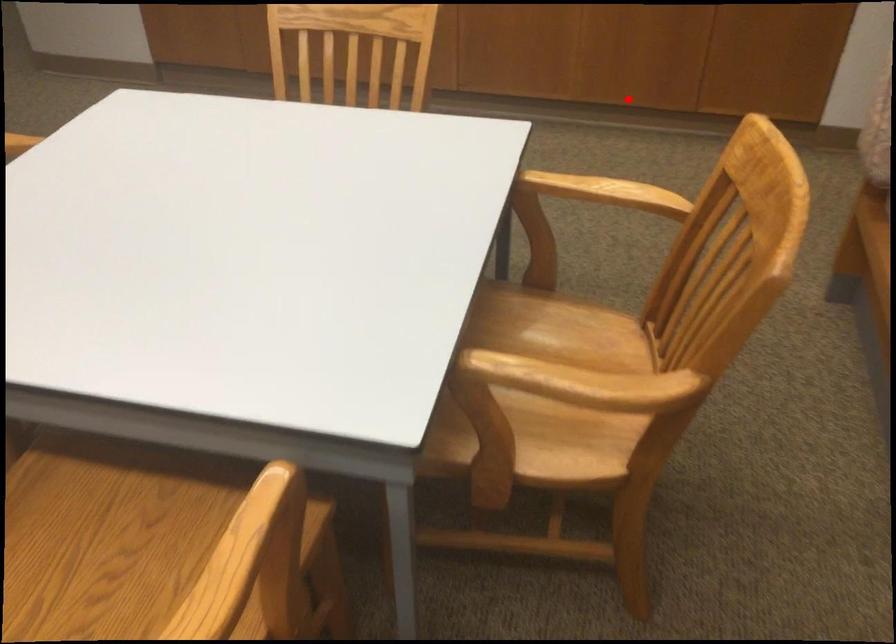
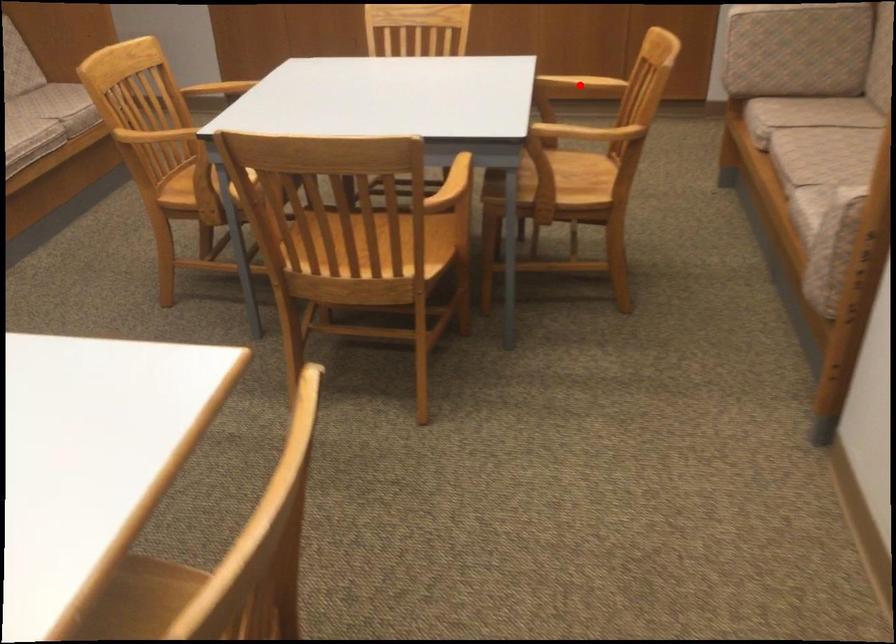
I am providing you with two images of the same scene from different viewpoints. A red point is marked on the first image and another point is marked on the second image. Is the marked point in image1 the same physical position as the marked point in image2?

Yes